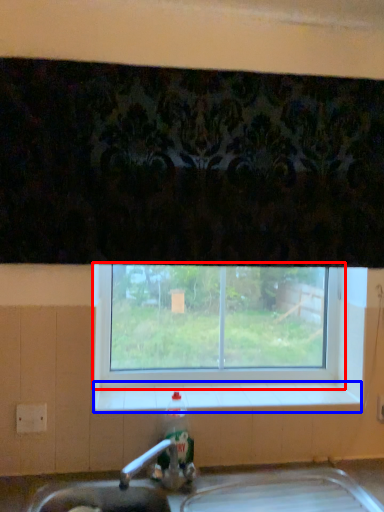
Question: Which point is closer to the camera, window (highlighted by a red box) or window sill (highlighted by a blue box)?

Choices:
 (A) window
 (B) window sill

Answer: (B)